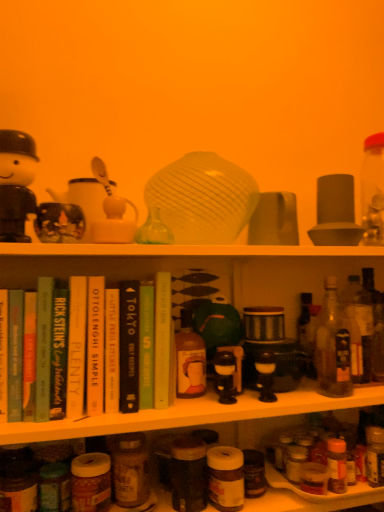
Measure the distance between point (116, 355) and camera.

Point (116, 355) and camera are 34.41 inches apart from each other.

Looking at this image, measure the distance between translucent glass bottle at right, marked as the first bottle in a right-to-left arrangement, and camera.

A distance of 3.36 feet exists between translucent glass bottle at right, marked as the first bottle in a right-to-left arrangement, and camera.

Describe the element at coordinates (130, 470) in the screenshot. I see `matte brown bottle at lower center, marked as the first bottle in a left-to-right arrangement` at that location.

At what (x,y) coordinates should I click in order to perform the action: click on translucent glass bottle at center, which ranks as the fourth bottle in right-to-left order. Please return your answer as a coordinate pair (x, y). Looking at the image, I should click on click(x=189, y=359).

What do you see at coordinates (189, 359) in the screenshot?
I see `translucent glass bottle at center, which ranks as the fourth bottle in right-to-left order` at bounding box center [189, 359].

Image resolution: width=384 pixels, height=512 pixels. What do you see at coordinates (375, 455) in the screenshot? I see `translucent glass bottle at lower right, the second bottle from the right` at bounding box center [375, 455].

What do you see at coordinates (216, 322) in the screenshot? Image resolution: width=384 pixels, height=512 pixels. I see `green matte teapot at center, placed as the 4th toy when sorted from top to bottom` at bounding box center [216, 322].

Locate an element on the screen. The image size is (384, 512). hardcover book at center, acting as the 4th book starting from the right is located at coordinates (112, 351).

Is translucent glass bottle at right, the third bottle in the left-to-right sequence, at the right side of hardcover book at center, acting as the 4th book starting from the right?

Yes.

Find the location of a particular element. book that is the 1st one below the translucent glass bottle at right, the third bottle in the left-to-right sequence (from a real-world perspective) is located at coordinates (112, 351).

Is translucent glass bottle at right, the third bottle in the left-to-right sequence, inside the boundaries of hardcover book at center, acting as the 4th book starting from the right, or outside?

translucent glass bottle at right, the third bottle in the left-to-right sequence, lies outside hardcover book at center, acting as the 4th book starting from the right.

From the picture: How far apart are translucent glass bottle at right, the third bottle in the left-to-right sequence, and hardcover book at center, placed as the 2th book when sorted from left to right?

translucent glass bottle at right, the third bottle in the left-to-right sequence, is 20.99 inches away from hardcover book at center, placed as the 2th book when sorted from left to right.

Is green matte book at center, the 4th book viewed from the left, at the back of matte black figurine at upper left, which appears as the 3th toy when viewed from the top?

matte black figurine at upper left, which appears as the 3th toy when viewed from the top, does not have its back to green matte book at center, the 4th book viewed from the left.

Based on the photo, considering the positions of objects matte black figurine at upper left, which appears as the 3th toy when viewed from the top, and green matte book at center, which appears as the 2th book when viewed from the right, in the image provided, who is in front, matte black figurine at upper left, which appears as the 3th toy when viewed from the top, or green matte book at center, which appears as the 2th book when viewed from the right,?

matte black figurine at upper left, which appears as the 3th toy when viewed from the top, is closer to the camera.

Considering the positions of objects matte black figurine at upper left, the 2th toy in the left-to-right sequence, and green matte book at center, the 4th book viewed from the left, in the image provided, who is more to the left, matte black figurine at upper left, the 2th toy in the left-to-right sequence, or green matte book at center, the 4th book viewed from the left,?

Positioned to the left is matte black figurine at upper left, the 2th toy in the left-to-right sequence.

At what (x,y) coordinates should I click in order to perform the action: click on the 1st book in front of the translucent glass bottle at right, marked as the first bottle in a right-to-left arrangement, counting from the anchor's position. Please return your answer as a coordinate pair (x, y). Image resolution: width=384 pixels, height=512 pixels. Looking at the image, I should click on (162, 339).

From a real-world perspective, is hardcover book at center, which is the 1th book in right-to-left order, positioned above or below translucent glass bottle at right, marked as the first bottle in a right-to-left arrangement?

hardcover book at center, which is the 1th book in right-to-left order, is above translucent glass bottle at right, marked as the first bottle in a right-to-left arrangement.

From the image's perspective, is hardcover book at center, which is the 1th book in right-to-left order, on top of translucent glass bottle at right, marked as the first bottle in a right-to-left arrangement?

Yes, from the image's perspective, hardcover book at center, which is the 1th book in right-to-left order, is above translucent glass bottle at right, marked as the first bottle in a right-to-left arrangement.

What's the angular difference between black hardcover book at center, the third book positioned from the right, and hardcover book at center, placed as the 2th book when sorted from left to right,'s facing directions?

0.519 degrees separate the facing orientations of black hardcover book at center, the third book positioned from the right, and hardcover book at center, placed as the 2th book when sorted from left to right.

Is hardcover book at center, placed as the 2th book when sorted from left to right, surrounded by black hardcover book at center, the third book positioned from the right?

No, hardcover book at center, placed as the 2th book when sorted from left to right, is not inside black hardcover book at center, the third book positioned from the right.

Is point (133, 411) positioned in front of point (113, 329)?

That is True.

From a real-world perspective, is black hardcover book at center, which is counted as the third book, starting from the left, physically located above or below matte brown bottle at lower center, marked as the first bottle in a left-to-right arrangement?

From a real-world perspective, black hardcover book at center, which is counted as the third book, starting from the left, is physically above matte brown bottle at lower center, marked as the first bottle in a left-to-right arrangement.

Considering the sizes of black hardcover book at center, the third book positioned from the right, and matte brown bottle at lower center, marked as the first bottle in a left-to-right arrangement, in the image, is black hardcover book at center, the third book positioned from the right, bigger or smaller than matte brown bottle at lower center, marked as the first bottle in a left-to-right arrangement,?

In the image, black hardcover book at center, the third book positioned from the right, appears to be larger than matte brown bottle at lower center, marked as the first bottle in a left-to-right arrangement.

From the image's perspective, which is above, black hardcover book at center, the third book positioned from the right, or matte brown bottle at lower center, marked as the first bottle in a left-to-right arrangement?

black hardcover book at center, the third book positioned from the right, is shown above in the image.

Is point (129, 298) behind point (128, 441)?

That is False.

Does translucent glass bottle at lower right, marked as the fourth bottle in a left-to-right arrangement, touch green matte teapot at center, which is the 1th toy in back-to-front order?

No, translucent glass bottle at lower right, marked as the fourth bottle in a left-to-right arrangement, is not touching green matte teapot at center, which is the 1th toy in back-to-front order.

Would you say translucent glass bottle at lower right, marked as the fourth bottle in a left-to-right arrangement, contains green matte teapot at center, placed as the 4th toy when sorted from top to bottom?

No.

Is point (374, 476) farther from camera compared to point (226, 302)?

No, it is not.

How many degrees apart are the facing directions of translucent glass bottle at lower right, the second bottle from the right, and green matte teapot at center, the fourth toy positioned from the left?

The facing directions of translucent glass bottle at lower right, the second bottle from the right, and green matte teapot at center, the fourth toy positioned from the left, are 5.8 degrees apart.

Where is `the 2nd book counting from the right of the matte white figurine at upper center, which ranks as the 2th toy in top-to-bottom order`? The image size is (384, 512). the 2nd book counting from the right of the matte white figurine at upper center, which ranks as the 2th toy in top-to-bottom order is located at coordinates (129, 346).

Does matte white figurine at upper center, which ranks as the 2th toy in top-to-bottom order, appear on the right side of black hardcover book at center, which is counted as the third book, starting from the left?

No, matte white figurine at upper center, which ranks as the 2th toy in top-to-bottom order, is not to the right of black hardcover book at center, which is counted as the third book, starting from the left.

Considering the sizes of matte white figurine at upper center, which is the third toy from left to right, and black hardcover book at center, the third book positioned from the right, in the image, is matte white figurine at upper center, which is the third toy from left to right, bigger or smaller than black hardcover book at center, the third book positioned from the right,?

Clearly, matte white figurine at upper center, which is the third toy from left to right, is smaller in size than black hardcover book at center, the third book positioned from the right.

Is point (110, 229) farther from camera compared to point (129, 397)?

That is True.

From the hardcover book at center, placed as the 2th book when sorted from left to right, count 2nd bottles backward and point to it. Please provide its 2D coordinates.

[(333, 346)]

Where is `the 4th book to the right of the matte black figurine at upper left, marked as the 3th toy in a back-to-front arrangement, starting your count from the anchor`? The width and height of the screenshot is (384, 512). the 4th book to the right of the matte black figurine at upper left, marked as the 3th toy in a back-to-front arrangement, starting your count from the anchor is located at coordinates (146, 345).

From the image, which object appears to be farther from translucent glass bottle at center, which is counted as the 2th bottle, starting from the left, matte white figurine at upper center, which is the third toy from left to right, or matte black figurine at upper left, the 4th toy when ordered from bottom to top?

matte black figurine at upper left, the 4th toy when ordered from bottom to top, lies further to translucent glass bottle at center, which is counted as the 2th bottle, starting from the left, than the other object.

Estimate the real-world distances between objects in this image. Which object is closer to translucent glass bottle at center, which ranks as the fourth bottle in right-to-left order, hardcover book at center, placed as the 2th book when sorted from left to right, or black hardcover book at center, which is counted as the third book, starting from the left?

black hardcover book at center, which is counted as the third book, starting from the left, is closer to translucent glass bottle at center, which ranks as the fourth bottle in right-to-left order.

Considering their positions, is hardcover book at center, positioned as the 5th book in right-to-left order, positioned closer to matte white figurine at upper center, which is the third toy from left to right, than green matte book at center, the 4th book viewed from the left?

Based on the image, hardcover book at center, positioned as the 5th book in right-to-left order, appears to be nearer to matte white figurine at upper center, which is the third toy from left to right.

Based on their spatial positions, is hardcover book at center, positioned as the 5th book in right-to-left order, or translucent glass bottle at center, which ranks as the fourth bottle in right-to-left order, closer to matte brown bottle at lower center, marked as the first bottle in a left-to-right arrangement?

hardcover book at center, positioned as the 5th book in right-to-left order, lies closer to matte brown bottle at lower center, marked as the first bottle in a left-to-right arrangement, than the other object.

From the image, which object appears to be nearer to hardcover book at center, acting as the 4th book starting from the right, translucent glass bottle at center, which is counted as the 2th bottle, starting from the left, or matte white figurine at upper center, placed as the third toy when sorted from front to back?

The object closer to hardcover book at center, acting as the 4th book starting from the right, is translucent glass bottle at center, which is counted as the 2th bottle, starting from the left.

Estimate the real-world distances between objects in this image. Which object is closer to hardcover book at center, the 5th book in the left-to-right sequence, matte black figurine at upper left, the 1th toy positioned from the top, or black hardcover book at center, the third book positioned from the right?

black hardcover book at center, the third book positioned from the right.

Which object lies further to the anchor point translucent glass bottle at right, the third bottle in the left-to-right sequence, matte black figurine at upper left, which appears as the 3th toy when viewed from the top, or hardcover book at center, the 5th book in the left-to-right sequence?

matte black figurine at upper left, which appears as the 3th toy when viewed from the top, is further to translucent glass bottle at right, the third bottle in the left-to-right sequence.

From the picture: When comparing their distances from matte black figurine at upper left, which is the 2th toy from front to back, does black hardcover book at center, the third book positioned from the right, or matte brown bottle at lower center, marked as the first bottle in a left-to-right arrangement, seem closer?

The object closer to matte black figurine at upper left, which is the 2th toy from front to back, is black hardcover book at center, the third book positioned from the right.

Where is `toy between black hardcover book at center, the third book positioned from the right, and translucent glass bottle at right, which is counted as the 5th bottle, starting from the left, in the horizontal direction`? Image resolution: width=384 pixels, height=512 pixels. toy between black hardcover book at center, the third book positioned from the right, and translucent glass bottle at right, which is counted as the 5th bottle, starting from the left, in the horizontal direction is located at coordinates (x=216, y=322).

Identify the location of toy between hardcover book at center, which is counted as the first book, starting from the left, and matte brown bottle at lower center, marked as the first bottle in a left-to-right arrangement, in the vertical direction. (216, 322).

This screenshot has width=384, height=512. Find the location of `toy between black hardcover book at center, the third book positioned from the right, and translucent glass bottle at right, which is counted as the third bottle, starting from the right, from left to right`. toy between black hardcover book at center, the third book positioned from the right, and translucent glass bottle at right, which is counted as the third bottle, starting from the right, from left to right is located at coordinates (216, 322).

The image size is (384, 512). I want to click on toy between translucent glass bottle at center, which is counted as the 2th bottle, starting from the left, and translucent glass bottle at right, the third bottle in the left-to-right sequence, from left to right, so click(x=216, y=322).